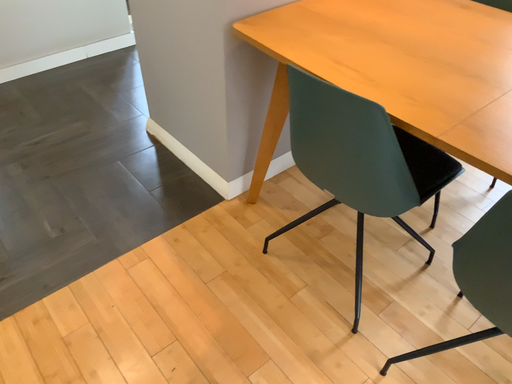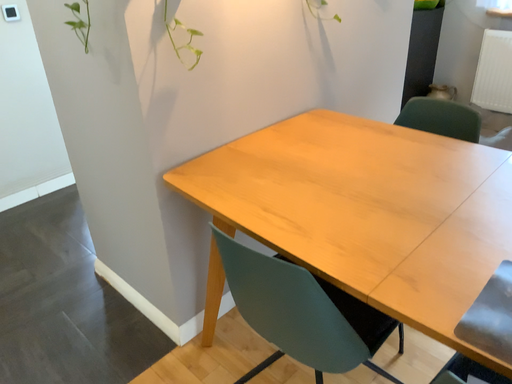
Question: How did the camera likely rotate when shooting the video?

Choices:
 (A) rotated upward
 (B) rotated downward

Answer: (A)